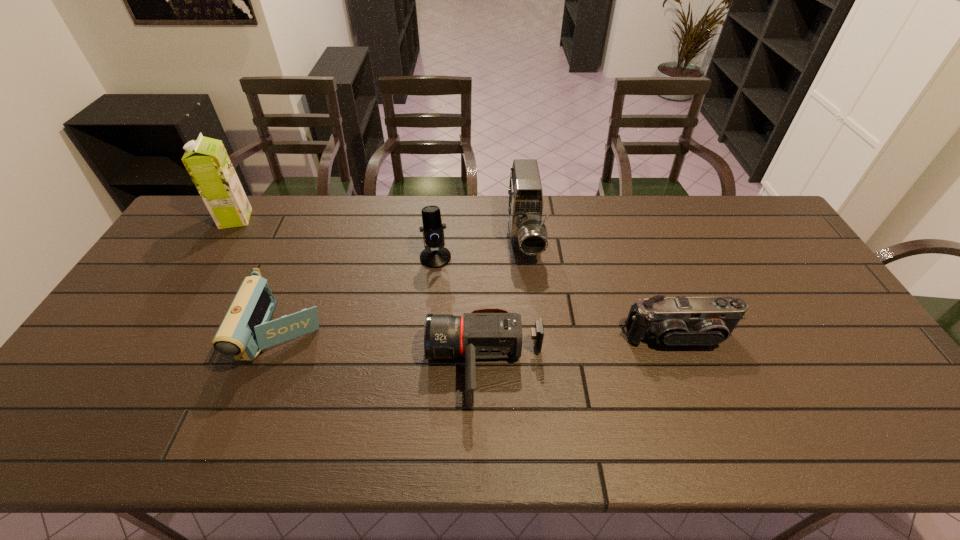
Where is `the second closest camcorder to the farthest camcorder`? The height and width of the screenshot is (540, 960). the second closest camcorder to the farthest camcorder is located at coordinates (700, 321).

Find the location of a particular element. Image resolution: width=960 pixels, height=540 pixels. vacant region that satisfies the following two spatial constraints: 1. at the front of the tallest camcorder, highlighting the lens; 2. on the lens of the shortest object is located at coordinates (538, 365).

Identify the location of vacant region that satisfies the following two spatial constraints: 1. at the front of the second tallest object, highlighting the lens; 2. on the lens of the shortest object. (538, 365).

Locate an element on the screen. This screenshot has height=540, width=960. vacant space that satisfies the following two spatial constraints: 1. on the front-facing side of the rightmost camcorder; 2. on the lens of the shortest object is located at coordinates (688, 365).